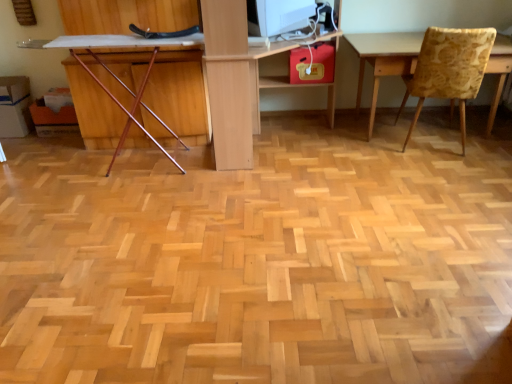
Where is `light wood computer desk at center`? light wood computer desk at center is located at coordinates (234, 81).

What do you see at coordinates (449, 70) in the screenshot?
I see `yellow floral fabric chair at right, placed as the second chair when sorted from left to right` at bounding box center [449, 70].

Find the location of `light wood computer desk at center`. light wood computer desk at center is located at coordinates (234, 81).

Is white glossy computer monitor at upper center far away from yellow floral fabric chair at right, the 1th chair positioned from the right?

No.

In the image, is white glossy computer monitor at upper center positioned in front of or behind yellow floral fabric chair at right, the 1th chair positioned from the right?

white glossy computer monitor at upper center is behind yellow floral fabric chair at right, the 1th chair positioned from the right.

Considering the sizes of objects white glossy computer monitor at upper center and yellow floral fabric chair at right, placed as the second chair when sorted from left to right, in the image provided, who is bigger, white glossy computer monitor at upper center or yellow floral fabric chair at right, placed as the second chair when sorted from left to right,?

Bigger between the two is yellow floral fabric chair at right, placed as the second chair when sorted from left to right.

Is white glossy computer monitor at upper center thinner than yellow floral fabric chair at right, placed as the second chair when sorted from left to right?

Yes, white glossy computer monitor at upper center is thinner than yellow floral fabric chair at right, placed as the second chair when sorted from left to right.

How many degrees apart are the facing directions of yellow floral fabric chair at right, placed as the second chair when sorted from left to right, and light wood computer desk at center?

The angle between the facing direction of yellow floral fabric chair at right, placed as the second chair when sorted from left to right, and the facing direction of light wood computer desk at center is 169 degrees.

Consider the image. From a real-world perspective, is yellow floral fabric chair at right, placed as the second chair when sorted from left to right, above or below light wood computer desk at center?

Answer: In terms of real-world spatial position, yellow floral fabric chair at right, placed as the second chair when sorted from left to right, is below light wood computer desk at center.

Consider the image. Which is correct: yellow floral fabric chair at right, the 1th chair positioned from the right, is inside light wood computer desk at center, or outside of it?

yellow floral fabric chair at right, the 1th chair positioned from the right, exists outside the volume of light wood computer desk at center.

Is yellow floral fabric chair at right, placed as the second chair when sorted from left to right, to the right of light wood computer desk at center from the viewer's perspective?

Indeed, yellow floral fabric chair at right, placed as the second chair when sorted from left to right, is positioned on the right side of light wood computer desk at center.

Is wooden chair at left, placed as the 2th chair when sorted from right to left, situated inside yellow floral fabric chair at right, the 1th chair positioned from the right, or outside?

wooden chair at left, placed as the 2th chair when sorted from right to left, is not enclosed by yellow floral fabric chair at right, the 1th chair positioned from the right.

From a real-world perspective, is wooden chair at left, placed as the 2th chair when sorted from right to left, below yellow floral fabric chair at right, placed as the second chair when sorted from left to right?

Yes, from a real-world perspective, wooden chair at left, placed as the 2th chair when sorted from right to left, is below yellow floral fabric chair at right, placed as the second chair when sorted from left to right.

Is wooden chair at left, placed as the 2th chair when sorted from right to left, far from yellow floral fabric chair at right, placed as the second chair when sorted from left to right?

Indeed, wooden chair at left, placed as the 2th chair when sorted from right to left, is not near yellow floral fabric chair at right, placed as the second chair when sorted from left to right.

Can you tell me how much wooden chair at left, which appears as the first chair when viewed from the left, and yellow floral fabric chair at right, the 1th chair positioned from the right, differ in facing direction?

165 degrees.

From the image's perspective, would you say light wood computer desk at center is positioned over white glossy computer monitor at upper center?

No, from the image's perspective, light wood computer desk at center is not over white glossy computer monitor at upper center.

Is light wood computer desk at center beside white glossy computer monitor at upper center?

They are not placed beside each other.

How many degrees apart are the facing directions of light wood computer desk at center and white glossy computer monitor at upper center?

light wood computer desk at center and white glossy computer monitor at upper center are facing 75.8 degrees away from each other.

Is light wood computer desk at center behind white glossy computer monitor at upper center?

No, it is in front of white glossy computer monitor at upper center.

From the image's perspective, who appears lower, light wood computer desk at center or wooden chair at left, placed as the 2th chair when sorted from right to left?

wooden chair at left, placed as the 2th chair when sorted from right to left.

Does point (214, 131) come closer to viewer compared to point (120, 141)?

Yes, it is in front of point (120, 141).

Is light wood computer desk at center inside the boundaries of wooden chair at left, which appears as the first chair when viewed from the left, or outside?

light wood computer desk at center lies outside wooden chair at left, which appears as the first chair when viewed from the left.

Which is correct: yellow floral fabric chair at right, the 1th chair positioned from the right, is inside wooden chair at left, which appears as the first chair when viewed from the left, or outside of it?

yellow floral fabric chair at right, the 1th chair positioned from the right, lies outside wooden chair at left, which appears as the first chair when viewed from the left.

Is point (440, 91) farther from camera compared to point (112, 165)?

That is False.

Does yellow floral fabric chair at right, the 1th chair positioned from the right, have a lesser height compared to wooden chair at left, which appears as the first chair when viewed from the left?

Incorrect, the height of yellow floral fabric chair at right, the 1th chair positioned from the right, does not fall short of that of wooden chair at left, which appears as the first chair when viewed from the left.

Which object is further away from the camera taking this photo, yellow floral fabric chair at right, the 1th chair positioned from the right, or wooden chair at left, placed as the 2th chair when sorted from right to left?

yellow floral fabric chair at right, the 1th chair positioned from the right.

Considering the relative positions of light wood computer desk at center and yellow floral fabric chair at right, placed as the second chair when sorted from left to right, in the image provided, is light wood computer desk at center to the right of yellow floral fabric chair at right, placed as the second chair when sorted from left to right, from the viewer's perspective?

In fact, light wood computer desk at center is to the left of yellow floral fabric chair at right, placed as the second chair when sorted from left to right.

From a real-world perspective, which is physically above, light wood computer desk at center or yellow floral fabric chair at right, the 1th chair positioned from the right?

light wood computer desk at center, from a real-world perspective.

Looking at their sizes, would you say light wood computer desk at center is wider or thinner than yellow floral fabric chair at right, placed as the second chair when sorted from left to right?

Considering their sizes, light wood computer desk at center looks broader than yellow floral fabric chair at right, placed as the second chair when sorted from left to right.

Between light wood computer desk at center and yellow floral fabric chair at right, placed as the second chair when sorted from left to right, which one has larger size?

Bigger between the two is light wood computer desk at center.

This screenshot has height=384, width=512. I want to click on chair on the right of white glossy computer monitor at upper center, so click(x=449, y=70).

From the image's perspective, starting from the light wood computer desk at center, which chair is the 1st one below? Please provide its 2D coordinates.

[(449, 70)]

From the image, which object appears to be farther from wooden chair at left, which appears as the first chair when viewed from the left, light wood computer desk at center or white glossy computer monitor at upper center?

The object further to wooden chair at left, which appears as the first chair when viewed from the left, is white glossy computer monitor at upper center.

Considering their positions, is wooden chair at left, which appears as the first chair when viewed from the left, positioned further to white glossy computer monitor at upper center than light wood computer desk at center?

wooden chair at left, which appears as the first chair when viewed from the left, is positioned further to the anchor white glossy computer monitor at upper center.

From the image, which object appears to be nearer to light wood computer desk at center, wooden chair at left, placed as the 2th chair when sorted from right to left, or yellow floral fabric chair at right, the 1th chair positioned from the right?

wooden chair at left, placed as the 2th chair when sorted from right to left.

Estimate the real-world distances between objects in this image. Which object is further from white glossy computer monitor at upper center, yellow floral fabric chair at right, the 1th chair positioned from the right, or wooden chair at left, placed as the 2th chair when sorted from right to left?

yellow floral fabric chair at right, the 1th chair positioned from the right.

Based on the photo, from the image, which object appears to be farther from wooden chair at left, which appears as the first chair when viewed from the left, yellow floral fabric chair at right, the 1th chair positioned from the right, or light wood computer desk at center?

Based on the image, yellow floral fabric chair at right, the 1th chair positioned from the right, appears to be further to wooden chair at left, which appears as the first chair when viewed from the left.

Looking at the image, which one is located closer to yellow floral fabric chair at right, placed as the second chair when sorted from left to right, white glossy computer monitor at upper center or light wood computer desk at center?

white glossy computer monitor at upper center is closer to yellow floral fabric chair at right, placed as the second chair when sorted from left to right.

Which object lies further to the anchor point light wood computer desk at center, yellow floral fabric chair at right, placed as the second chair when sorted from left to right, or white glossy computer monitor at upper center?

yellow floral fabric chair at right, placed as the second chair when sorted from left to right, lies further to light wood computer desk at center than the other object.

Considering their positions, is white glossy computer monitor at upper center positioned closer to light wood computer desk at center than wooden chair at left, which appears as the first chair when viewed from the left?

white glossy computer monitor at upper center is positioned closer to the anchor light wood computer desk at center.

Locate an element on the screen. computer desk situated between wooden chair at left, which appears as the first chair when viewed from the left, and white glossy computer monitor at upper center from left to right is located at coordinates (234, 81).

The width and height of the screenshot is (512, 384). I want to click on computer desk between wooden chair at left, placed as the 2th chair when sorted from right to left, and yellow floral fabric chair at right, the 1th chair positioned from the right, from left to right, so click(x=234, y=81).

Identify the location of computer monitor between light wood computer desk at center and yellow floral fabric chair at right, the 1th chair positioned from the right. This screenshot has width=512, height=384. (278, 16).

Find the location of `computer monitor between wooden chair at left, which appears as the first chair when viewed from the left, and yellow floral fabric chair at right, the 1th chair positioned from the right, in the horizontal direction`. computer monitor between wooden chair at left, which appears as the first chair when viewed from the left, and yellow floral fabric chair at right, the 1th chair positioned from the right, in the horizontal direction is located at coordinates (278, 16).